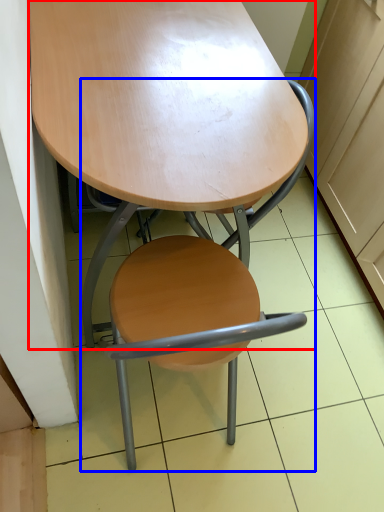
Question: Among these objects, which one is farthest to the camera, table (highlighted by a red box) or chair (highlighted by a blue box)?

Choices:
 (A) table
 (B) chair

Answer: (A)